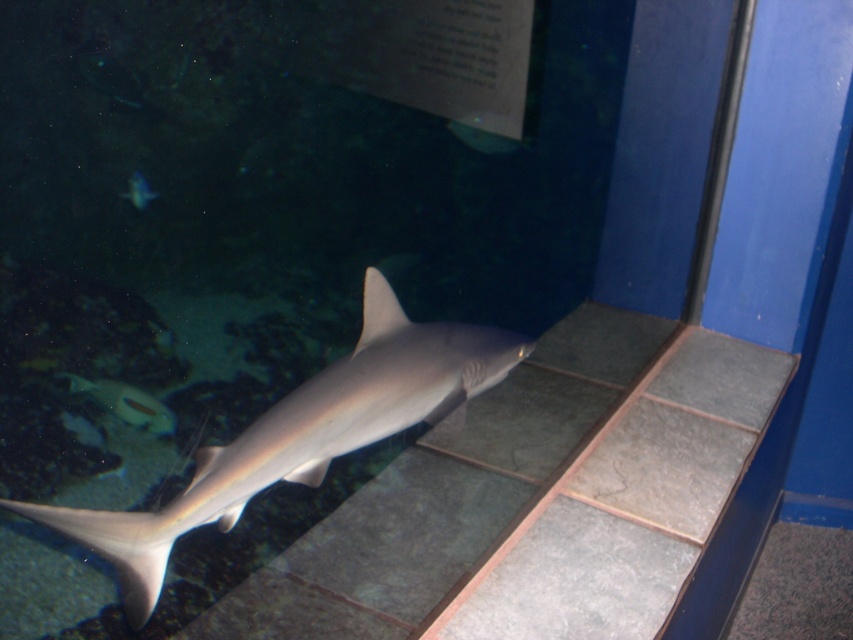
You are a visitor at the aquarium and want to take a photo of the shiny silver fish at lower left. The aquarium has a glass surface that reflects light. Where should you position yourself to avoid reflections on the glass when taking the photo?

To avoid reflections on the glass when taking a photo of the shiny silver fish at lower left, position yourself so that the light source is behind you and aligned with the camera lens. This way, the reflection will be minimized, allowing a clear view of the fish.

You are an underwater photographer aiming to capture both the shiny silver fish at lower left and the translucent blue fish at upper left in a single frame. Based on their positions, which fish is closer to the camera lens?

The shiny silver fish at lower left is positioned under the translucent blue fish at upper left, meaning it is closer to the camera lens.

You are an aquarium visitor observing the tank. You notice the shiny silver fish at lower left and the translucent blue fish at upper left. Which fish is wider?

The shiny silver fish at lower left is wider than the translucent blue fish at upper left.